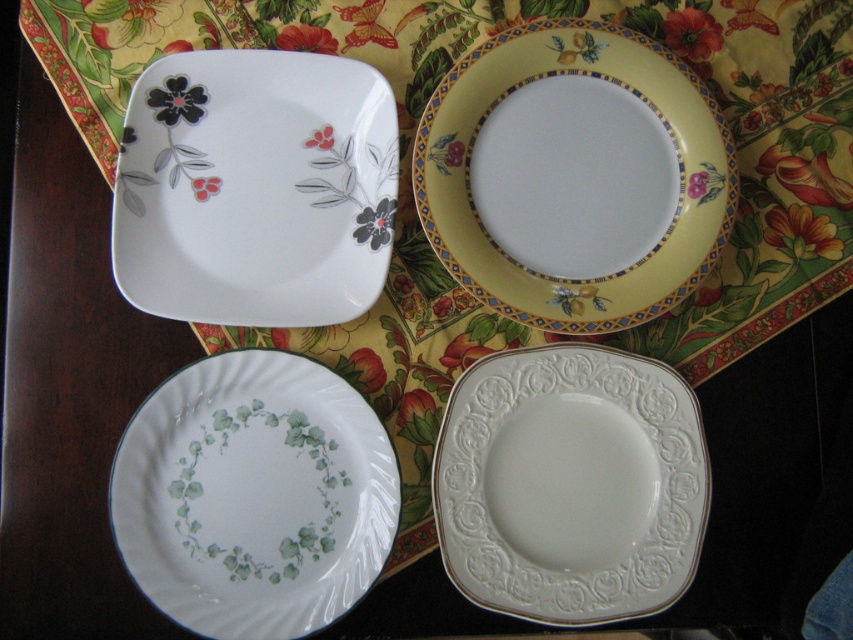
Question: In this image, where is white glossy square plate at upper left located relative to yellow glossy plate at upper center?

Choices:
 (A) above
 (B) below

Answer: (B)

Question: Which of the following is the closest to the observer?

Choices:
 (A) white glossy square plate at upper left
 (B) yellow glossy plate at upper center

Answer: (A)

Question: Which object is farther from the camera taking this photo?

Choices:
 (A) white porcelain saucer at bottom right
 (B) yellow glossy plate at upper center
 (C) white glossy square plate at upper left
 (D) white porcelain saucer at bottom left

Answer: (B)

Question: Which object appears closest to the camera in this image?

Choices:
 (A) white porcelain saucer at bottom left
 (B) white porcelain saucer at bottom right
 (C) yellow glossy plate at upper center

Answer: (A)

Question: Is white porcelain saucer at bottom right bigger than yellow glossy plate at upper center?

Choices:
 (A) yes
 (B) no

Answer: (A)

Question: Can you confirm if white glossy square plate at upper left is positioned above white porcelain saucer at bottom right?

Choices:
 (A) no
 (B) yes

Answer: (B)